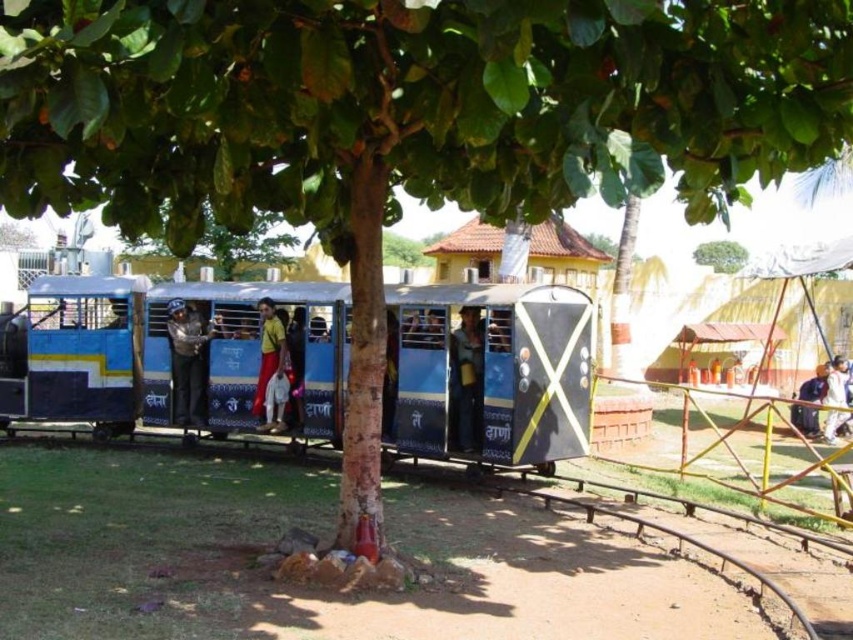
Question: Can you confirm if yellow fabric at center is bigger than dark blue fabric shirt at right?

Choices:
 (A) yes
 (B) no

Answer: (B)

Question: Is blue painted metal train at center below white fabric at right?

Choices:
 (A) yes
 (B) no

Answer: (B)

Question: Based on their relative distances, which object is nearer to the yellow fabric at center?

Choices:
 (A) green leafy tree at center
 (B) blue painted metal train at center
 (C) dark blue fabric shirt at right
 (D) blue fabric train at center

Answer: (B)

Question: Which point is farther to the camera?

Choices:
 (A) (173, 385)
 (B) (312, 417)

Answer: (A)

Question: Is yellow fabric at center smaller than dark blue fabric shirt at right?

Choices:
 (A) no
 (B) yes

Answer: (B)

Question: Among these objects, which one is nearest to the camera?

Choices:
 (A) yellow fabric at center
 (B) blue painted metal train at center
 (C) white fabric at right

Answer: (B)